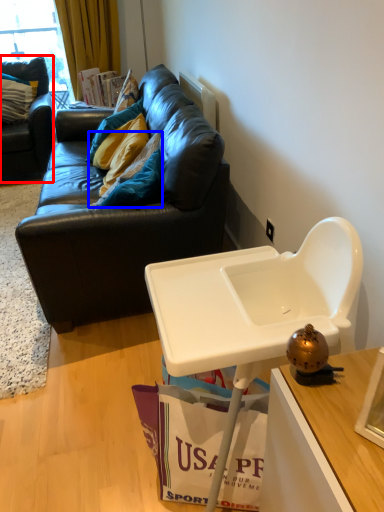
Question: Which object is further to the camera taking this photo, studio couch (highlighted by a red box) or pillow (highlighted by a blue box)?

Choices:
 (A) studio couch
 (B) pillow

Answer: (A)